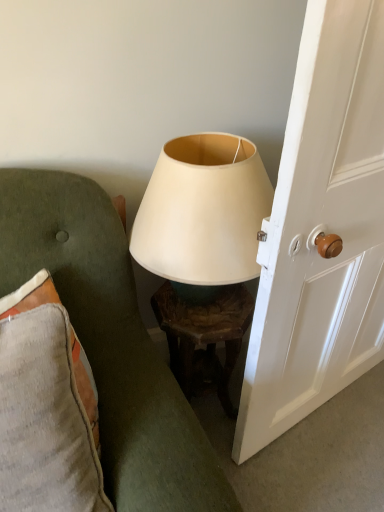
In order to face matte white lampshade at center, should I rotate leftwards or rightwards?

A 0.554 degree turn to the right will do.

In order to face textured gray pillow at left, should I rotate leftwards or rightwards?

You should rotate left by 20.119 degrees.

Identify the location of wooden textured table at center. (204, 337).

From a real-world perspective, which object stands above the other?

textured gray pillow at left is physically above.

Is wooden textured table at center in front of textured gray pillow at left?

No, wooden textured table at center is behind textured gray pillow at left.

Does wooden textured table at center appear on the right side of textured gray cushion at left?

Yes, wooden textured table at center is to the right of textured gray cushion at left.

The image size is (384, 512). Identify the location of table behind the textured gray cushion at left. (204, 337).

Is textured gray cushion at left surrounded by wooden textured table at center?

That's incorrect, textured gray cushion at left is not inside wooden textured table at center.

From the image's perspective, is wooden textured table at center on textured gray cushion at left?

No, from the image's perspective, wooden textured table at center is not on top of textured gray cushion at left.

I want to click on lamp that appears above the textured gray cushion at left (from the image's perspective), so click(x=203, y=251).

Which object is thinner, textured gray cushion at left or matte white lampshade at center?

With smaller width is textured gray cushion at left.

Does textured gray cushion at left have a lesser height compared to matte white lampshade at center?

In fact, textured gray cushion at left may be taller than matte white lampshade at center.

Between textured gray cushion at left and textured gray pillow at left, which one appears on the right side from the viewer's perspective?

textured gray cushion at left.

From a real-world perspective, is textured gray cushion at left physically located above or below textured gray pillow at left?

Clearly, from a real-world perspective, textured gray cushion at left is above textured gray pillow at left.

Can you confirm if textured gray cushion at left is bigger than textured gray pillow at left?

Yes, textured gray cushion at left is bigger than textured gray pillow at left.

In the scene shown: Is textured gray cushion at left closer to the viewer compared to textured gray pillow at left?

Yes, textured gray cushion at left is closer to the camera.

Is white wood door at right oriented towards textured gray cushion at left?

No, white wood door at right is not aimed at textured gray cushion at left.

From the picture: Is white wood door at right further to the viewer compared to textured gray cushion at left?

Yes, white wood door at right is further from the viewer.

Looking at the image, does white wood door at right seem bigger or smaller compared to textured gray cushion at left?

white wood door at right is bigger than textured gray cushion at left.

Is white wood door at right positioned far away from textured gray pillow at left?

No.

In the scene shown: From their relative heights in the image, would you say white wood door at right is taller or shorter than textured gray pillow at left?

Clearly, white wood door at right is taller compared to textured gray pillow at left.

At what (x,y) coordinates should I click in order to perform the action: click on screen door above the textured gray pillow at left (from the image's perspective). Please return your answer as a coordinate pair (x, y). The width and height of the screenshot is (384, 512). Looking at the image, I should click on (x=321, y=230).

In the image, is white wood door at right positioned in front of or behind textured gray pillow at left?

Visually, white wood door at right is located behind textured gray pillow at left.

Considering the positions of points (21, 260) and (187, 314), is point (21, 260) closer to camera compared to point (187, 314)?

That is True.

Is textured gray cushion at left next to wooden textured table at center?

No, textured gray cushion at left is not touching wooden textured table at center.

Consider the image. Who is more distant, textured gray cushion at left or wooden textured table at center?

wooden textured table at center is more distant.

Where is `pillow on the left of wooden textured table at center`? This screenshot has width=384, height=512. pillow on the left of wooden textured table at center is located at coordinates pyautogui.click(x=46, y=407).

Identify the location of furniture above the wooden textured table at center (from the image's perspective). (110, 342).

When comparing their distances from wooden textured table at center, does textured gray pillow at left or textured gray cushion at left seem further?

textured gray pillow at left.

Looking at the image, which one is located further to matte white lampshade at center, white wood door at right or wooden textured table at center?

white wood door at right is positioned further to the anchor matte white lampshade at center.

Based on their spatial positions, is white wood door at right or textured gray pillow at left closer to matte white lampshade at center?

Among the two, white wood door at right is located nearer to matte white lampshade at center.

When comparing their distances from textured gray cushion at left, does wooden textured table at center or textured gray pillow at left seem further?

wooden textured table at center is further to textured gray cushion at left.

Looking at the image, which one is located closer to wooden textured table at center, white wood door at right or textured gray pillow at left?

white wood door at right is positioned closer to the anchor wooden textured table at center.

Based on their spatial positions, is white wood door at right or textured gray cushion at left closer to matte white lampshade at center?

white wood door at right is closer to matte white lampshade at center.

Estimate the real-world distances between objects in this image. Which object is further from textured gray cushion at left, wooden textured table at center or matte white lampshade at center?

Among the two, wooden textured table at center is located further to textured gray cushion at left.

Based on their spatial positions, is white wood door at right or wooden textured table at center closer to textured gray cushion at left?

The object closer to textured gray cushion at left is wooden textured table at center.

Identify the location of table between textured gray cushion at left and white wood door at right in the horizontal direction. (204, 337).

I want to click on lamp located between textured gray cushion at left and white wood door at right in the left-right direction, so click(203, 251).

This screenshot has height=512, width=384. I want to click on lamp positioned between textured gray pillow at left and wooden textured table at center from near to far, so click(203, 251).

Identify the location of lamp between textured gray pillow at left and white wood door at right from left to right. This screenshot has width=384, height=512. (203, 251).